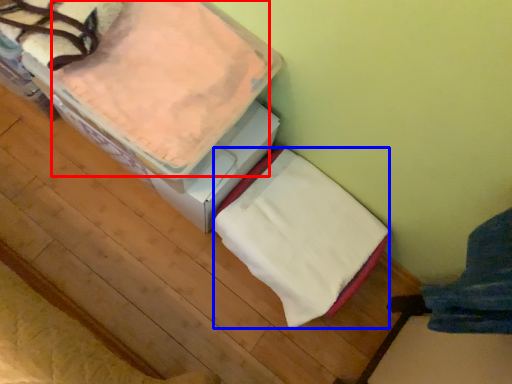
Question: Which object appears closest to the camera in this image, sheet (highlighted by a red box) or blanket (highlighted by a blue box)?

Choices:
 (A) sheet
 (B) blanket

Answer: (A)